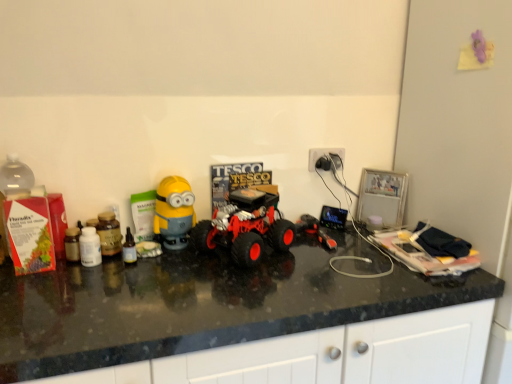
Image resolution: width=512 pixels, height=384 pixels. Find the location of `vacant space in front of rubberized black toy truck at center, arranged as the 3th toy when viewed from the left`. vacant space in front of rubberized black toy truck at center, arranged as the 3th toy when viewed from the left is located at coordinates (331, 262).